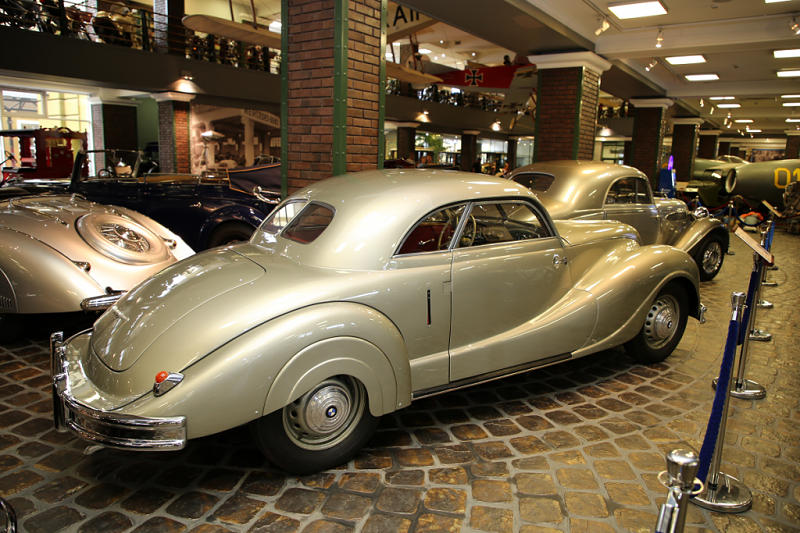
Identify the location of green color on column. The image size is (800, 533). (338, 55), (382, 48), (281, 67), (576, 131), (534, 109).